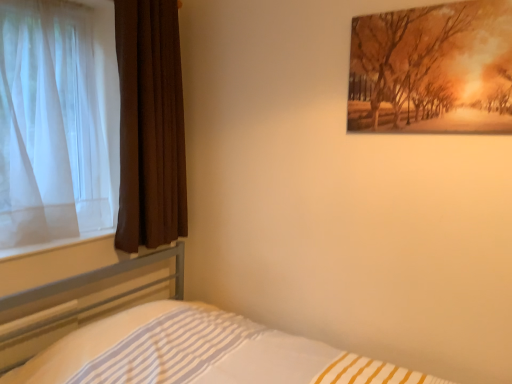
Question: From a real-world perspective, is white striped fabric at lower left above or below matte orange painting at upper right?

Choices:
 (A) below
 (B) above

Answer: (A)

Question: Is white striped fabric at lower left wider or thinner than matte orange painting at upper right?

Choices:
 (A) wide
 (B) thin

Answer: (A)

Question: Which is nearer to the brown velvet curtain at left, the 1th curtain positioned from the right?

Choices:
 (A) matte orange painting at upper right
 (B) white sheer curtain at left, the 1th curtain when ordered from left to right
 (C) white striped fabric at lower left

Answer: (B)

Question: Which object is positioned farthest from the brown velvet curtain at left, the 1th curtain positioned from the right?

Choices:
 (A) matte orange painting at upper right
 (B) white striped fabric at lower left
 (C) white sheer curtain at left, which is counted as the 2th curtain, starting from the right

Answer: (A)